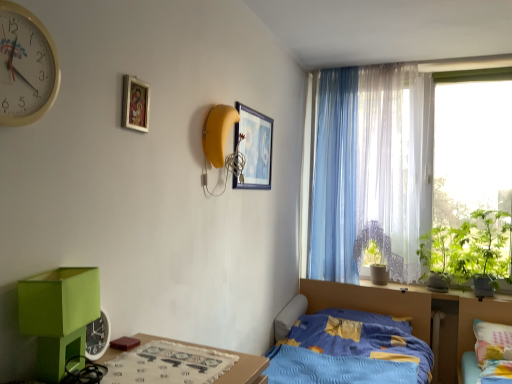
Question: Considering the relative sizes of wooden picture frame at upper center, which appears as the 1th picture frame when viewed from the right, and green leafy plant at window, which is the second plant from left to right, in the image provided, is wooden picture frame at upper center, which appears as the 1th picture frame when viewed from the right, thinner than green leafy plant at window, which is the second plant from left to right,?

Choices:
 (A) yes
 (B) no

Answer: (A)

Question: Does wooden picture frame at upper center, marked as the 2th picture frame in a left-to-right arrangement, touch green leafy plant at window, which is the second plant from left to right?

Choices:
 (A) no
 (B) yes

Answer: (A)

Question: Is the position of wooden picture frame at upper center, positioned as the 2th picture frame in front-to-back order, more distant than that of green leafy plant at window, which is the second plant from left to right?

Choices:
 (A) yes
 (B) no

Answer: (B)

Question: Could green leafy plant at window, which is the second plant from left to right, be considered to be inside wooden picture frame at upper center, positioned as the 2th picture frame in front-to-back order?

Choices:
 (A) no
 (B) yes

Answer: (A)

Question: From the image's perspective, is wooden picture frame at upper center, marked as the 2th picture frame in a left-to-right arrangement, on top of green leafy plant at window, the 2th plant in the right-to-left sequence?

Choices:
 (A) yes
 (B) no

Answer: (A)

Question: Would you say blue quilted bed at center, positioned as the 2th bed in right-to-left order, is inside or outside light blue sheer curtain at center, positioned as the 1th curtain in left-to-right order?

Choices:
 (A) inside
 (B) outside

Answer: (B)

Question: Looking at the image, does blue quilted bed at center, the first bed in the left-to-right sequence, seem bigger or smaller compared to light blue sheer curtain at center, positioned as the 1th curtain in left-to-right order?

Choices:
 (A) small
 (B) big

Answer: (B)

Question: In the image, is blue quilted bed at center, the first bed in the left-to-right sequence, on the left side or the right side of light blue sheer curtain at center, positioned as the 1th curtain in left-to-right order?

Choices:
 (A) right
 (B) left

Answer: (B)

Question: From the image's perspective, is blue quilted bed at center, the first bed in the left-to-right sequence, above or below light blue sheer curtain at center, the 2th curtain from the right?

Choices:
 (A) below
 (B) above

Answer: (A)

Question: In the image, is yellow plastic clock at upper left positioned in front of or behind green leafy plant at window, the first plant viewed from the right?

Choices:
 (A) front
 (B) behind

Answer: (A)

Question: In terms of width, does yellow plastic clock at upper left look wider or thinner when compared to green leafy plant at window, the 3th plant when ordered from left to right?

Choices:
 (A) wide
 (B) thin

Answer: (B)

Question: From a real-world perspective, is yellow plastic clock at upper left positioned above or below green leafy plant at window, the 3th plant when ordered from left to right?

Choices:
 (A) below
 (B) above

Answer: (B)

Question: In terms of size, does yellow plastic clock at upper left appear bigger or smaller than green leafy plant at window, the first plant viewed from the right?

Choices:
 (A) small
 (B) big

Answer: (A)

Question: From the image's perspective, is wooden table at lower left located above or below blue quilted bed at center, positioned as the 2th bed in right-to-left order?

Choices:
 (A) below
 (B) above

Answer: (B)

Question: From a real-world perspective, is wooden table at lower left positioned above or below blue quilted bed at center, positioned as the 2th bed in right-to-left order?

Choices:
 (A) above
 (B) below

Answer: (A)